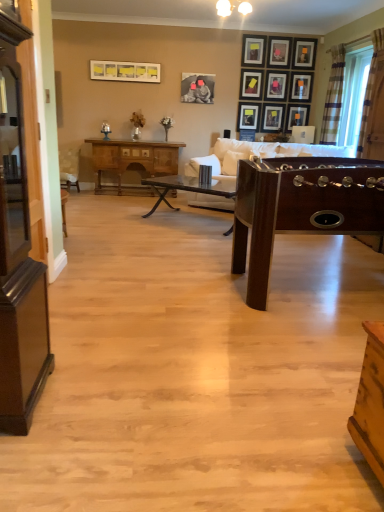
Question: Does point (306, 78) appear closer or farther from the camera than point (182, 94)?

Choices:
 (A) farther
 (B) closer

Answer: (A)

Question: In terms of height, does wooden picture frame at upper center, positioned as the 2th picture frame in right-to-left order, look taller or shorter compared to matte black picture frame at center, the 2th picture frame from the left?

Choices:
 (A) tall
 (B) short

Answer: (A)

Question: Which is farther from the wooden picture frame at upper center, arranged as the 4th picture frame when viewed from the right?

Choices:
 (A) matte black picture frame at upper right, which appears as the 9th picture frame when viewed from the left
 (B) mahogany wood foosball table at right, which is the 3th table in back-to-front order
 (C) wooden picture frame at upper center, marked as the 10th picture frame in a left-to-right arrangement
 (D) matte yellow picture frame at upper center, positioned as the 1th picture frame in left-to-right order
 (E) shiny dark wood cabinet at left

Answer: (E)

Question: Which of these objects is positioned farthest from the matte black picture frame at upper right, which appears as the 9th picture frame when viewed from the left?

Choices:
 (A) matte black picture frame at upper center, positioned as the fourth picture frame in left-to-right order
 (B) shiny dark wood cabinet at left
 (C) matte black picture frame at center, which is counted as the tenth picture frame, starting from the right
 (D) matte black picture frame at upper center, positioned as the 7th picture frame in left-to-right order
 (E) wooden picture frame at upper center, marked as the 10th picture frame in a left-to-right arrangement

Answer: (B)